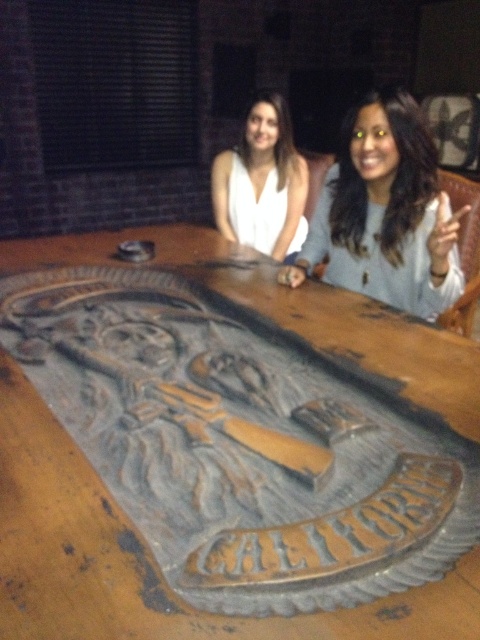
You are a photographer trying to capture a wide shot of the rustic wood table at center and the white matte shirt at center. Given that your camera can only focus on objects within a 1.5 meter width, will the entire scene fit in the frame?

The rustic wood table at center is wider than the white matte shirt at center. Since the camera can focus on objects within a 1.5 meter width, the entire scene may not fit if the table exceeds this width. However, without specific measurements, it is uncertain. Please check the actual dimensions.